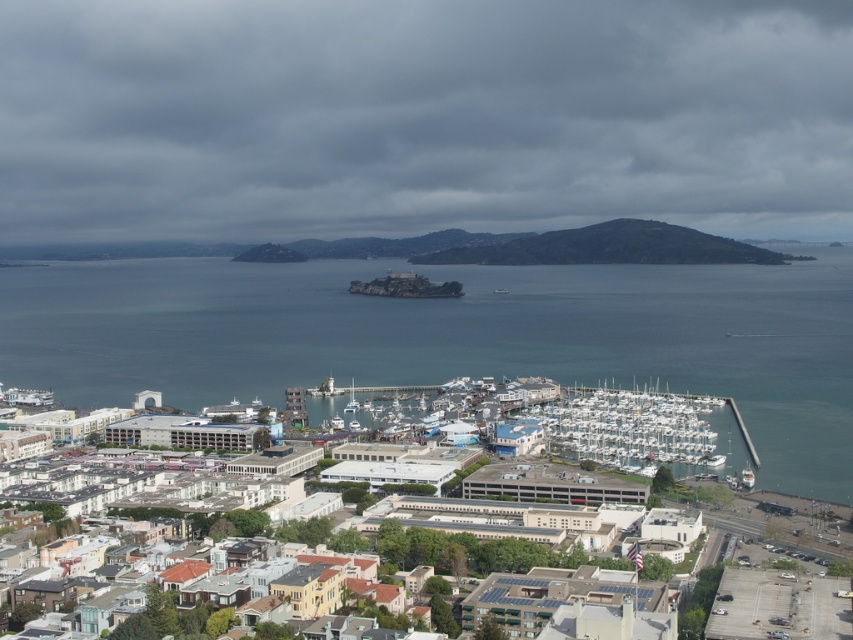
Does clear blue water at center have a lesser width compared to white glossy boat at lower center?

In fact, clear blue water at center might be wider than white glossy boat at lower center.

Does clear blue water at center come in front of white glossy boat at lower center?

Yes.

What are the coordinates of `clear blue water at center` in the screenshot? It's located at (454, 337).

Can you confirm if white matte buildings at center is positioned below white glossy boat at lower center?

Correct, white matte buildings at center is located below white glossy boat at lower center.

Looking at this image, can you confirm if white matte buildings at center is thinner than white glossy boat at lower center?

In fact, white matte buildings at center might be wider than white glossy boat at lower center.

Does point (624, 438) lie behind point (352, 396)?

Yes, it is.

This screenshot has width=853, height=640. Identify the location of white matte buildings at center. (628, 417).

This screenshot has height=640, width=853. Describe the element at coordinates (746, 477) in the screenshot. I see `white glossy boat at lower right` at that location.

Identify the location of white glossy boat at lower right. (746, 477).